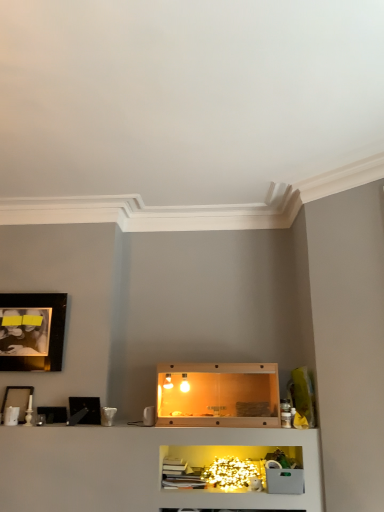
Question: Is black glossy picture frame at left, arranged as the first picture frame when viewed from the right, to the left of black glossy photo frame at upper left, marked as the 3th picture frame in a bottom-to-top arrangement, from the viewer's perspective?

Choices:
 (A) no
 (B) yes

Answer: (A)

Question: Is black glossy picture frame at left, which is the 3th picture frame in left-to-right order, at the right side of black glossy photo frame at upper left, which ranks as the second picture frame in right-to-left order?

Choices:
 (A) yes
 (B) no

Answer: (A)

Question: Does black glossy picture frame at left, the first picture frame from the bottom, have a lesser height compared to black glossy photo frame at upper left, marked as the second picture frame in a left-to-right arrangement?

Choices:
 (A) no
 (B) yes

Answer: (B)

Question: Is black glossy picture frame at left, the first picture frame from the bottom, oriented towards black glossy photo frame at upper left, marked as the second picture frame in a left-to-right arrangement?

Choices:
 (A) yes
 (B) no

Answer: (B)

Question: Is black glossy picture frame at left, which is the 3th picture frame in left-to-right order, behind black glossy photo frame at upper left, which ranks as the second picture frame in right-to-left order?

Choices:
 (A) yes
 (B) no

Answer: (B)

Question: Considering the relative sizes of black glossy picture frame at left, which is the 3th picture frame in left-to-right order, and black glossy photo frame at upper left, which ranks as the second picture frame in right-to-left order, in the image provided, is black glossy picture frame at left, which is the 3th picture frame in left-to-right order, smaller than black glossy photo frame at upper left, which ranks as the second picture frame in right-to-left order,?

Choices:
 (A) yes
 (B) no

Answer: (A)

Question: Is translucent glass shelf at center positioned in front of black glossy photo frame at upper left, which ranks as the second picture frame in right-to-left order?

Choices:
 (A) no
 (B) yes

Answer: (B)

Question: Are translucent glass shelf at center and black glossy photo frame at upper left, marked as the second picture frame in a left-to-right arrangement, located far from each other?

Choices:
 (A) yes
 (B) no

Answer: (A)

Question: From a real-world perspective, is translucent glass shelf at center below black glossy photo frame at upper left, the first picture frame from the top?

Choices:
 (A) yes
 (B) no

Answer: (A)

Question: Are translucent glass shelf at center and black glossy photo frame at upper left, the first picture frame from the top, beside each other?

Choices:
 (A) no
 (B) yes

Answer: (A)

Question: Is translucent glass shelf at center outside of black glossy photo frame at upper left, the first picture frame from the top?

Choices:
 (A) yes
 (B) no

Answer: (A)

Question: Can you confirm if translucent glass shelf at center is thinner than black glossy photo frame at upper left, marked as the 3th picture frame in a bottom-to-top arrangement?

Choices:
 (A) yes
 (B) no

Answer: (B)

Question: Could you tell me if black glossy picture frame at left, acting as the third picture frame starting from the top, is facing matte black picture frame at upper left, placed as the second picture frame when sorted from bottom to top?

Choices:
 (A) yes
 (B) no

Answer: (B)